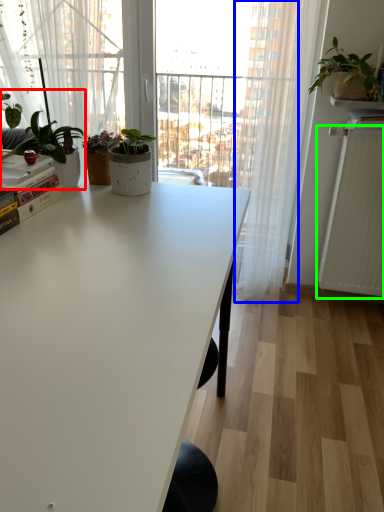
Question: Which object is the closest to the houseplant (highlighted by a red box)? Choose among these: curtain (highlighted by a blue box) or radiator (highlighted by a green box).

Choices:
 (A) curtain
 (B) radiator

Answer: (A)